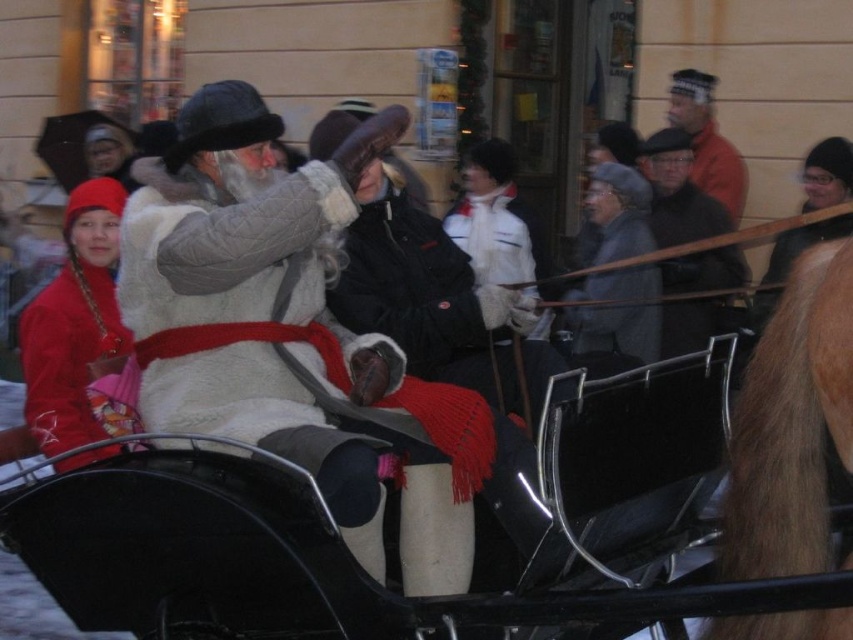
Question: Among these objects, which one is nearest to the camera?

Choices:
 (A) black knit hat at upper right
 (B) matte red jacket at left
 (C) white fur vest at center
 (D) white fur coat at center

Answer: (D)

Question: Which point is closer to the camera?

Choices:
 (A) [827, 140]
 (B) [602, 432]

Answer: (B)

Question: Which point is farther to the camera?

Choices:
 (A) (809, 156)
 (B) (849, 323)
 (C) (639, 452)

Answer: (A)

Question: Is white fur vest at center wider than brown fuzzy horse at right?

Choices:
 (A) no
 (B) yes

Answer: (B)

Question: Can you confirm if dark gray wool coat at center is positioned below black knit hat at upper right?

Choices:
 (A) no
 (B) yes

Answer: (B)

Question: Can you confirm if white fur coat at center is wider than black knit hat at upper right?

Choices:
 (A) no
 (B) yes

Answer: (B)